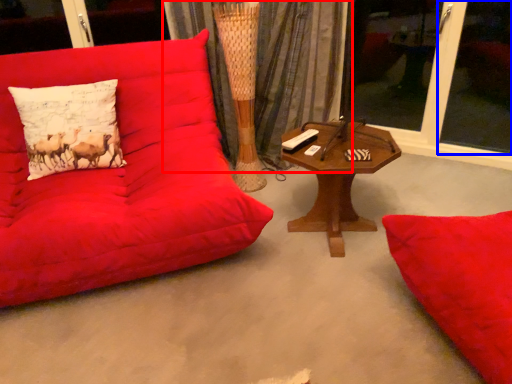
Question: Which point is further to the camera, curtain (highlighted by a red box) or window screen (highlighted by a blue box)?

Choices:
 (A) curtain
 (B) window screen

Answer: (A)